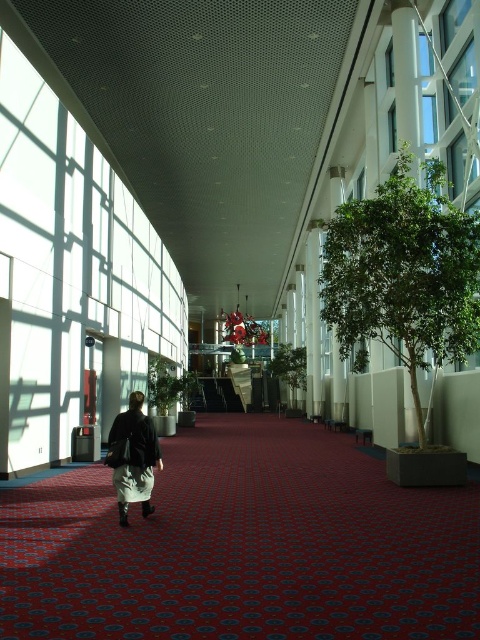
Question: Which object is positioned farthest from the dark brown leather jacket at center?

Choices:
 (A) green leafy tree at center
 (B) green leafy tree at right

Answer: (A)

Question: Can you confirm if green leafy tree at right is positioned to the right of green leafy tree at center?

Choices:
 (A) yes
 (B) no

Answer: (A)

Question: Among these points, which one is farthest from the camera?

Choices:
 (A) (121, 524)
 (B) (282, 349)
 (C) (375, 300)

Answer: (B)

Question: Is dark brown leather jacket at center to the left of green leafy tree at center from the viewer's perspective?

Choices:
 (A) yes
 (B) no

Answer: (A)

Question: Is dark brown leather jacket at center to the left of green leafy tree at center from the viewer's perspective?

Choices:
 (A) yes
 (B) no

Answer: (A)

Question: Which point appears farthest from the camera in this image?

Choices:
 (A) (151, 490)
 (B) (399, 221)
 (C) (280, 358)

Answer: (C)